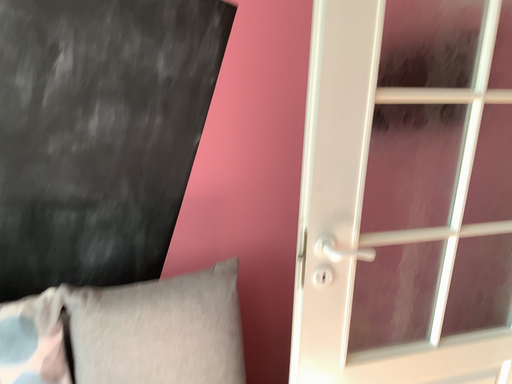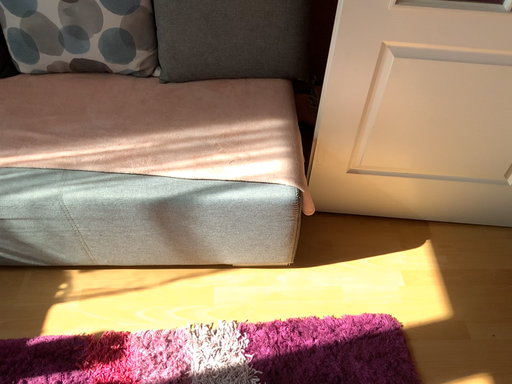
Question: Which way did the camera rotate in the video?

Choices:
 (A) rotated upward
 (B) rotated downward

Answer: (B)